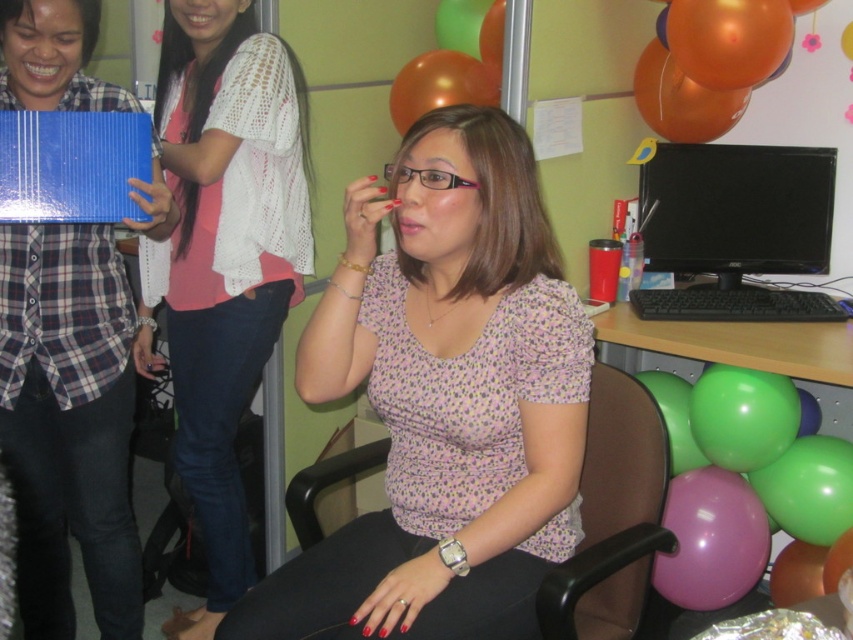
Question: Is black plastic swivel chair at center below orange glossy balloon at upper right?

Choices:
 (A) no
 (B) yes

Answer: (B)

Question: Which point is closer to the camera?

Choices:
 (A) orange metallic balloon at upper right
 (B) black plastic swivel chair at center
 (C) matte blue folder at left

Answer: (B)

Question: Which object is positioned farthest from the green rubber balloon at lower right?

Choices:
 (A) matte blue folder at left
 (B) orange glossy balloon at upper right
 (C) purple glossy balloon at lower right
 (D) orange metallic balloon at upper right

Answer: (A)

Question: Is matte blue folder at left smaller than green rubber balloon at lower right?

Choices:
 (A) yes
 (B) no

Answer: (B)

Question: Which object is positioned farthest from the pink crochet cardigan at upper left?

Choices:
 (A) orange glossy balloon at upper center
 (B) black glossy monitor at center

Answer: (B)

Question: Observing the image, what is the correct spatial positioning of pink floral blouse at center in reference to matte blue folder at left?

Choices:
 (A) left
 (B) right

Answer: (B)